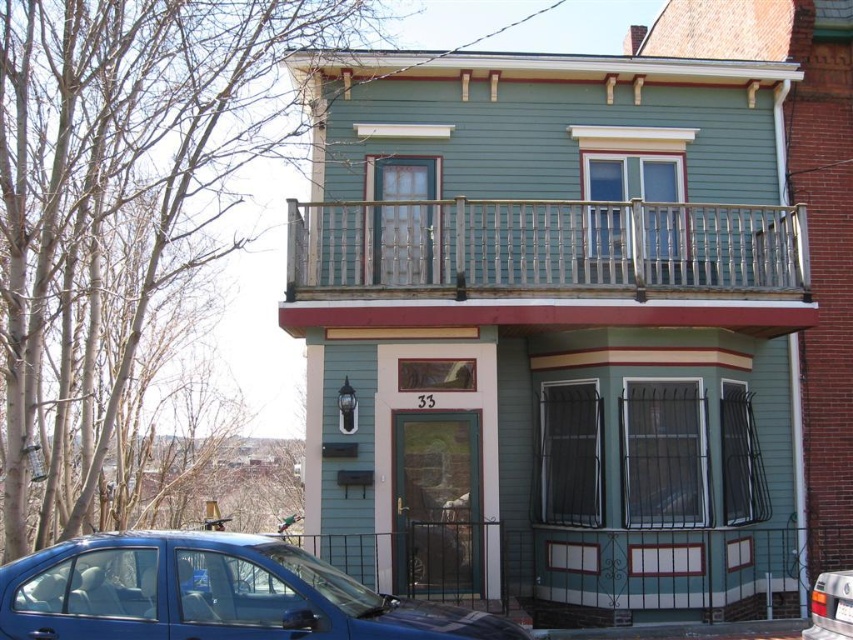
Looking at this image, can you confirm if wooden at upper center is wider than metallic blue sedan at lower left?

Yes, wooden at upper center is wider than metallic blue sedan at lower left.

What do you see at coordinates (544, 244) in the screenshot? I see `wooden at upper center` at bounding box center [544, 244].

Locate an element on the screen. The height and width of the screenshot is (640, 853). wooden at upper center is located at coordinates tap(544, 244).

Between wooden at upper center and metallic silver car at lower right, which one appears on the right side from the viewer's perspective?

metallic silver car at lower right is more to the right.

Does wooden at upper center have a smaller size compared to metallic silver car at lower right?

Actually, wooden at upper center might be larger than metallic silver car at lower right.

Is point (683, 248) behind point (846, 595)?

Yes, it is.

Where is `wooden at upper center`? This screenshot has width=853, height=640. wooden at upper center is located at coordinates (544, 244).

Which is above, metallic blue sedan at lower left or metallic silver car at lower right?

metallic blue sedan at lower left is higher up.

From the picture: Who is lower down, metallic blue sedan at lower left or metallic silver car at lower right?

metallic silver car at lower right

Does point (199, 545) come closer to viewer compared to point (802, 637)?

Yes.

Locate an element on the screen. metallic blue sedan at lower left is located at coordinates (212, 593).